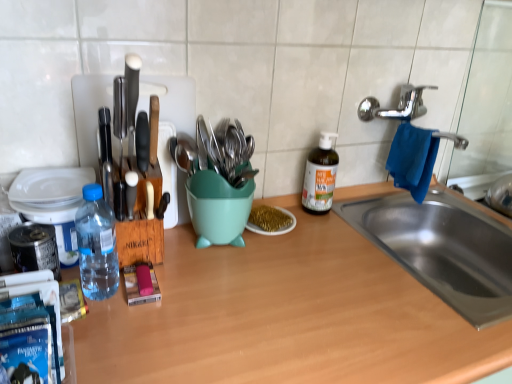
Question: Does green glass bottle at center, marked as the first bottle in a right-to-left arrangement, turn towards blue fabric hand towel at sink right?

Choices:
 (A) no
 (B) yes

Answer: (A)

Question: Does green glass bottle at center, marked as the first bottle in a right-to-left arrangement, have a greater width compared to blue fabric hand towel at sink right?

Choices:
 (A) no
 (B) yes

Answer: (A)

Question: From a real-world perspective, is green glass bottle at center, the first bottle when ordered from back to front, located beneath blue fabric hand towel at sink right?

Choices:
 (A) yes
 (B) no

Answer: (A)

Question: From a real-world perspective, is green glass bottle at center, marked as the first bottle in a right-to-left arrangement, over blue fabric hand towel at sink right?

Choices:
 (A) yes
 (B) no

Answer: (B)

Question: Is green glass bottle at center, acting as the 2th bottle starting from the front, positioned with its back to blue fabric hand towel at sink right?

Choices:
 (A) yes
 (B) no

Answer: (B)

Question: Is point [x=183, y=153] closer or farther from the camera than point [x=92, y=248]?

Choices:
 (A) closer
 (B) farther

Answer: (B)

Question: Do you think metallic utensils at center is within transparent plastic bottle at left, positioned as the first bottle in left-to-right order, or outside of it?

Choices:
 (A) outside
 (B) inside

Answer: (A)

Question: In terms of size, does metallic utensils at center appear bigger or smaller than transparent plastic bottle at left, placed as the second bottle when sorted from back to front?

Choices:
 (A) big
 (B) small

Answer: (A)

Question: In terms of width, does metallic utensils at center look wider or thinner when compared to transparent plastic bottle at left, placed as the second bottle when sorted from back to front?

Choices:
 (A) wide
 (B) thin

Answer: (A)

Question: Would you say gold glitter plate at center is to the left or to the right of blue plastic water bottle at left in the picture?

Choices:
 (A) left
 (B) right

Answer: (B)

Question: Which is correct: gold glitter plate at center is inside blue plastic water bottle at left, or outside of it?

Choices:
 (A) outside
 (B) inside

Answer: (A)

Question: From the image's perspective, relative to blue plastic water bottle at left, is gold glitter plate at center above or below?

Choices:
 (A) above
 (B) below

Answer: (A)

Question: Is gold glitter plate at center taller or shorter than blue plastic water bottle at left?

Choices:
 (A) tall
 (B) short

Answer: (B)

Question: From the image's perspective, is metallic utensils at center positioned above or below blue plastic water bottle at left?

Choices:
 (A) above
 (B) below

Answer: (A)

Question: Visually, is metallic utensils at center positioned to the left or to the right of blue plastic water bottle at left?

Choices:
 (A) right
 (B) left

Answer: (A)